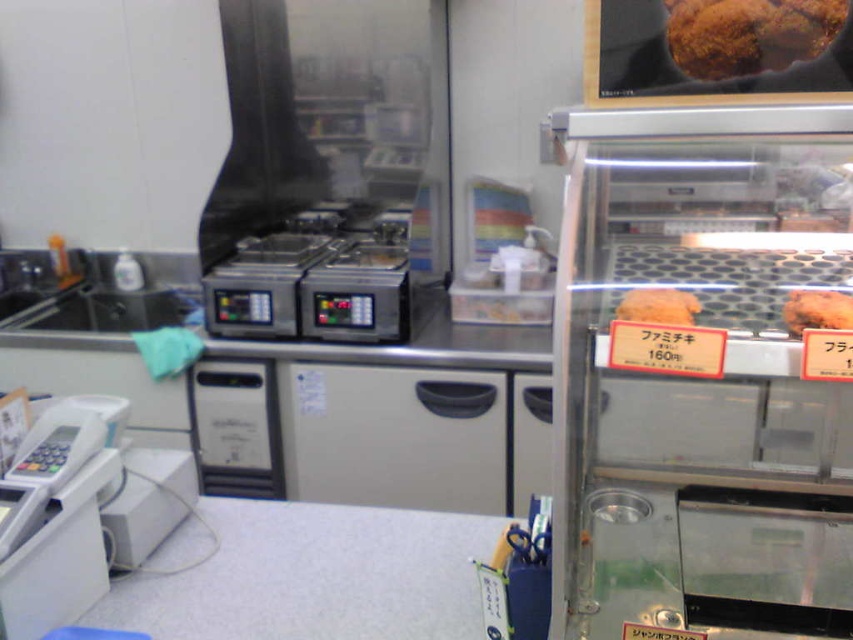
You are a delivery person who needs to place a large pizza box that is 28 inches wide onto the counter. The metallic glass display case at right is in the way. Can you slide the pizza box past the display case to the left side of the counter?

The metallic glass display case at right is 27.25 inches away from the viewer. Since the pizza box is 28 inches wide, it is slightly wider than the available space between the display case and the viewer, so it might not fit unless moved.

Consider the image. You are a customer in the restaurant and want to order a drink. The cashier tells you to look at the drink menu located at the metallic glass display case at right. Where should you look to find the drink menu?

The drink menu is located at the metallic glass display case at right, which is positioned at the coordinates point [703,378].

In the scene shown: You are a customer at this restaurant and want to reach the brown matte bread at upper right. However, there is a white laminate counter at lower center in your way. Can you easily access the bread without moving the counter?

The brown matte bread at upper right is behind the white laminate counter at lower center, so it might not be easily accessible without moving or going around the counter.